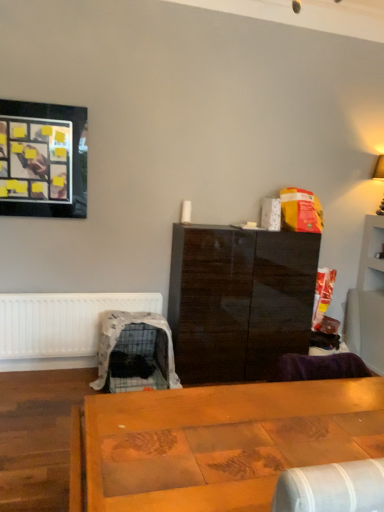
Question: From the image's perspective, is black glossy picture frame at upper left located above white matte radiator at lower left?

Choices:
 (A) no
 (B) yes

Answer: (B)

Question: Is black glossy picture frame at upper left further to camera compared to white matte radiator at lower left?

Choices:
 (A) no
 (B) yes

Answer: (A)

Question: Is black glossy picture frame at upper left thinner than white matte radiator at lower left?

Choices:
 (A) yes
 (B) no

Answer: (B)

Question: Is black glossy picture frame at upper left next to white matte radiator at lower left and touching it?

Choices:
 (A) no
 (B) yes

Answer: (A)

Question: Is black glossy picture frame at upper left outside of white matte radiator at lower left?

Choices:
 (A) no
 (B) yes

Answer: (B)

Question: From the image's perspective, is black glossy picture frame at upper left above or below glossy dark wood cabinet at center?

Choices:
 (A) below
 (B) above

Answer: (B)

Question: Is black glossy picture frame at upper left taller or shorter than glossy dark wood cabinet at center?

Choices:
 (A) tall
 (B) short

Answer: (B)

Question: Would you say black glossy picture frame at upper left is inside or outside glossy dark wood cabinet at center?

Choices:
 (A) outside
 (B) inside

Answer: (A)

Question: Is black glossy picture frame at upper left bigger or smaller than glossy dark wood cabinet at center?

Choices:
 (A) big
 (B) small

Answer: (B)

Question: Relative to plastic covered pet crate at lower left, is black glossy picture frame at upper left in front or behind?

Choices:
 (A) behind
 (B) front

Answer: (A)

Question: In terms of height, does black glossy picture frame at upper left look taller or shorter compared to plastic covered pet crate at lower left?

Choices:
 (A) short
 (B) tall

Answer: (B)

Question: Would you say black glossy picture frame at upper left is to the left or to the right of plastic covered pet crate at lower left in the picture?

Choices:
 (A) left
 (B) right

Answer: (A)

Question: Considering the positions of black glossy picture frame at upper left and plastic covered pet crate at lower left in the image, is black glossy picture frame at upper left bigger or smaller than plastic covered pet crate at lower left?

Choices:
 (A) small
 (B) big

Answer: (A)

Question: From a real-world perspective, relative to plastic covered pet crate at lower left, is glossy dark wood cabinet at center vertically above or below?

Choices:
 (A) above
 (B) below

Answer: (A)

Question: Is glossy dark wood cabinet at center in front of or behind plastic covered pet crate at lower left in the image?

Choices:
 (A) front
 (B) behind

Answer: (B)